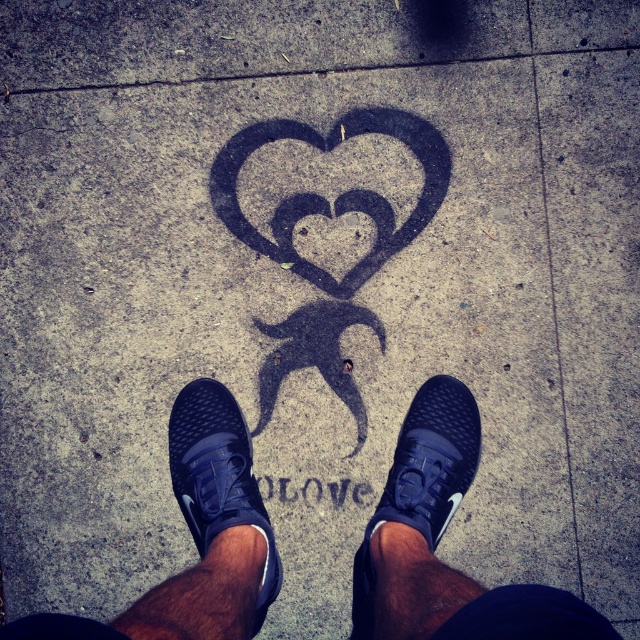
Which is in front, point (413, 520) or point (211, 534)?

Point (211, 534) is more forward.

What do you see at coordinates (420, 480) in the screenshot? I see `matte black shoe at center` at bounding box center [420, 480].

I want to click on matte black shoe at center, so click(x=420, y=480).

Locate an element on the screen. The image size is (640, 640). matte black shoe at center is located at coordinates (420, 480).

Between black mesh sneakers at center and matte black shoe at center, which one appears on the right side from the viewer's perspective?

matte black shoe at center is more to the right.

Can you confirm if black mesh sneakers at center is shorter than matte black shoe at center?

Correct, black mesh sneakers at center is not as tall as matte black shoe at center.

Is point (368, 636) farther from camera compared to point (464, 390)?

That is True.

Where is `black mesh sneakers at center`? The height and width of the screenshot is (640, 640). black mesh sneakers at center is located at coordinates (438, 540).

Who is higher up, black mesh sneakers at center or black chalk heart at center?

black chalk heart at center is above.

Who is more distant from viewer, (131, 609) or (230, 147)?

Point (230, 147)

Where is `black mesh sneakers at center`? The height and width of the screenshot is (640, 640). black mesh sneakers at center is located at coordinates (438, 540).